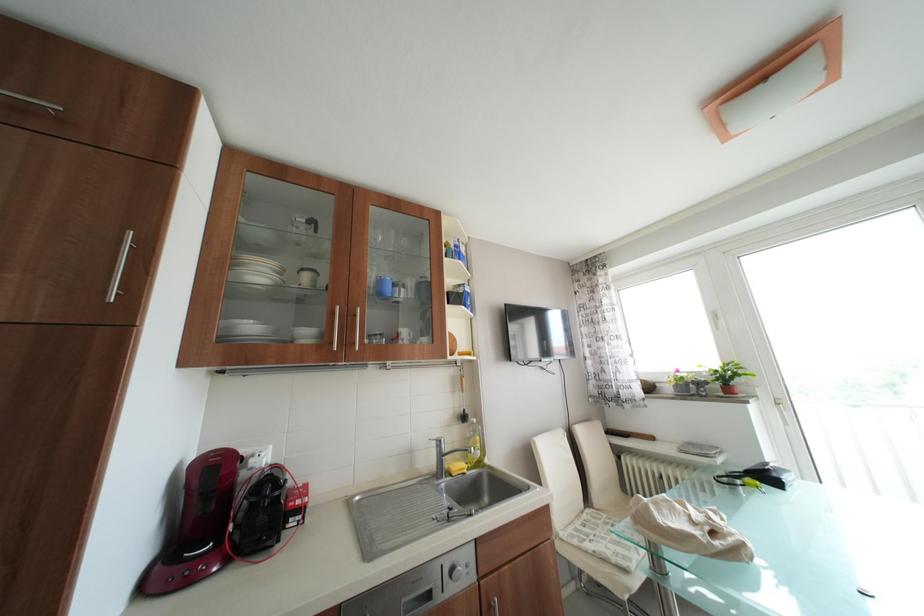
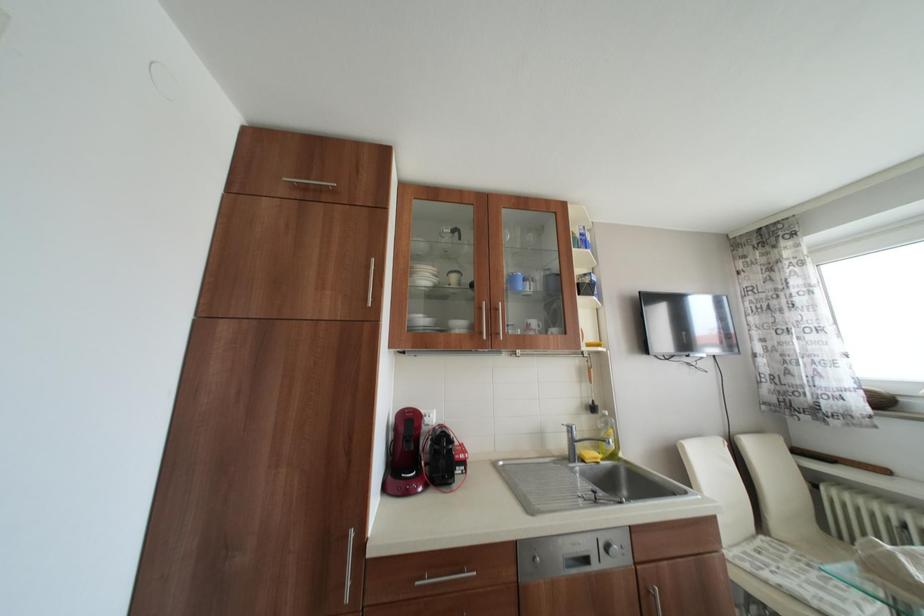
In a continuous first-person perspective shot, in which direction is the camera moving?

The cameraman walked toward left, backward.